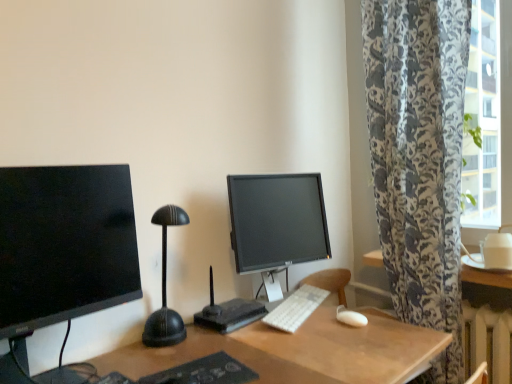
Question: From their relative heights in the image, would you say white matte mouse at lower right is taller or shorter than matte black monitor at left, which appears as the 1th computer monitor when viewed from the left?

Choices:
 (A) tall
 (B) short

Answer: (B)

Question: Is point (337, 306) positioned closer to the camera than point (98, 213)?

Choices:
 (A) closer
 (B) farther

Answer: (B)

Question: Estimate the real-world distances between objects in this image. Which object is farther from the white plastic keyboard at center?

Choices:
 (A) white matte mouse at lower right
 (B) matte black monitor at left, acting as the 1th computer monitor starting from the front
 (C) black plastic router at center
 (D) matte black monitor at center, the 2th computer monitor positioned from the left

Answer: (B)

Question: Which object is the farthest from the black plastic router at center?

Choices:
 (A) matte black monitor at left, acting as the 2th computer monitor starting from the right
 (B) white plastic keyboard at center
 (C) matte black monitor at center, which ranks as the 2th computer monitor in front-to-back order
 (D) white matte mouse at lower right

Answer: (A)